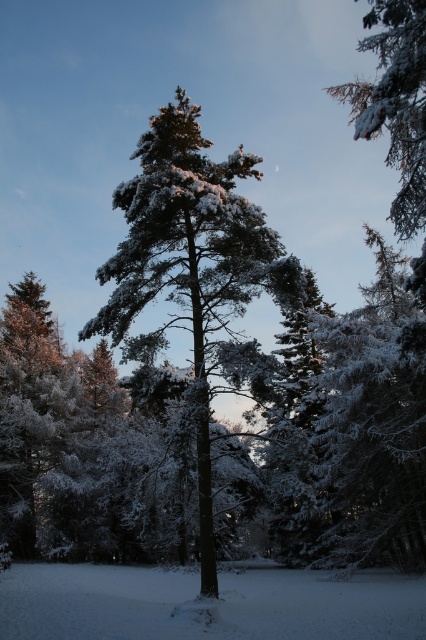
You are standing at the edge of the forest looking at the snow around the tall, snow covered pine tree at center. There is a point marked at coordinates (215, 604). What does this point represent?

The point at coordinates (215, 604) represents the location of the white fluffy snow at center.

You are an observer looking at the winter scene. You notice the white fluffy snow at center and the slightly frosted pine branch at upper right. Which object is positioned to the left of the other?

The white fluffy snow at center is to the left of the slightly frosted pine branch at upper right.